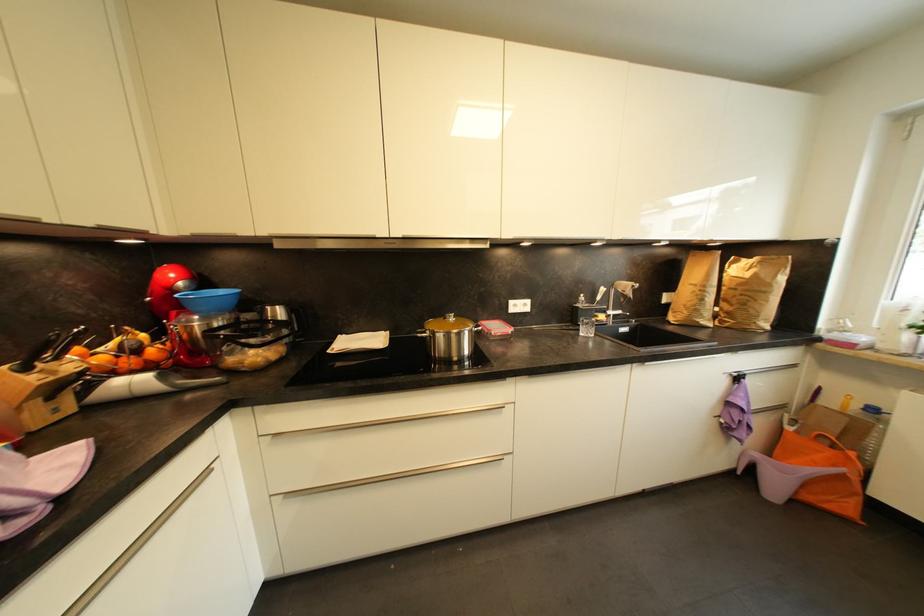
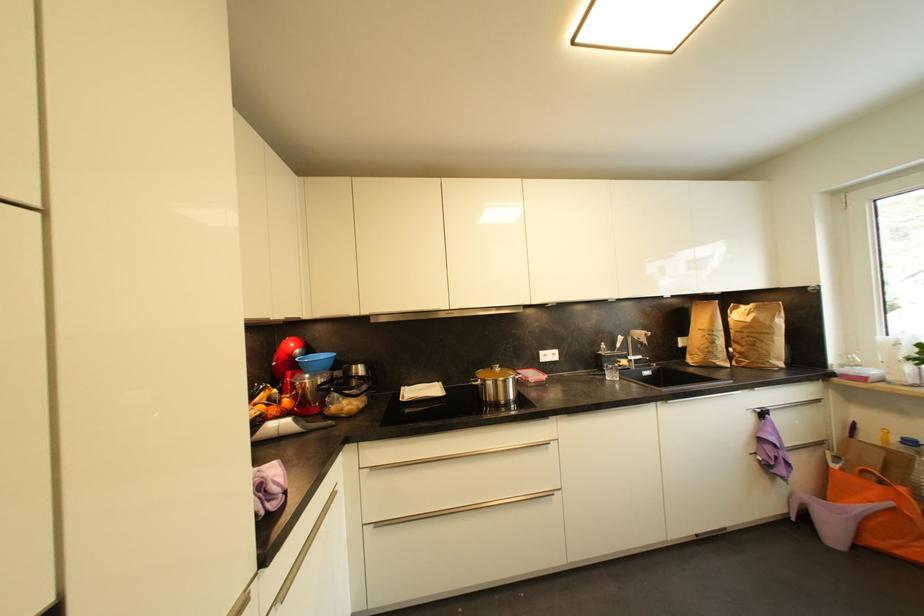
Where in the second image is the point corresponding to [177,293] from the first image?

(297, 359)